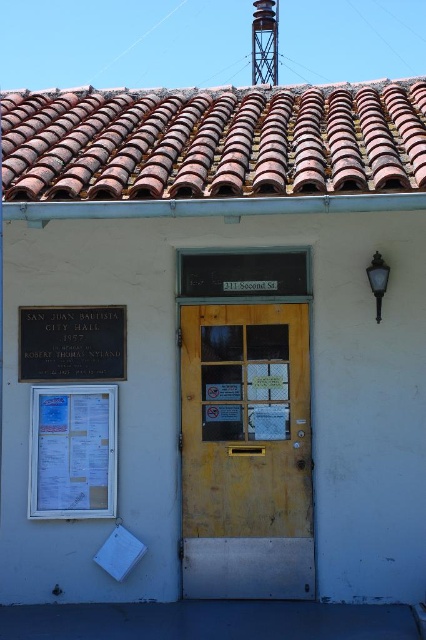
Does yellow wood door at center have a greater height compared to white paper at left?

Correct, yellow wood door at center is much taller as white paper at left.

Is point (221, 429) behind point (51, 403)?

Yes.

Where is `yellow wood door at center`? Image resolution: width=426 pixels, height=640 pixels. yellow wood door at center is located at coordinates (245, 420).

Is white paper at left closer to the viewer compared to metallic lattice water tower at upper center?

Yes, it is in front of metallic lattice water tower at upper center.

At what (x,y) coordinates should I click in order to perform the action: click on white paper at left. Please return your answer as a coordinate pair (x, y). The image size is (426, 640). Looking at the image, I should click on (72, 451).

Can you confirm if metallic plaque at left is positioned to the right of metallic lattice water tower at upper center?

No, metallic plaque at left is not to the right of metallic lattice water tower at upper center.

Is metallic plaque at left positioned in front of metallic lattice water tower at upper center?

Yes.

Between point (46, 333) and point (268, 35), which one is positioned behind?

The point (268, 35) is more distant.

At what (x,y) coordinates should I click in order to perform the action: click on metallic plaque at left. Please return your answer as a coordinate pair (x, y). This screenshot has height=640, width=426. Looking at the image, I should click on (71, 342).